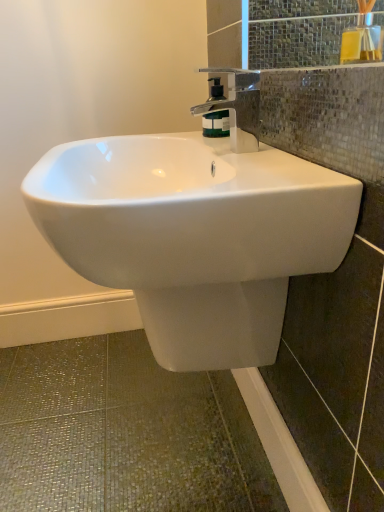
Question: From the image's perspective, is yellow glass bottle at upper right above or below white glossy sink at center?

Choices:
 (A) above
 (B) below

Answer: (A)

Question: Considering the positions of yellow glass bottle at upper right and white glossy sink at center in the image, is yellow glass bottle at upper right taller or shorter than white glossy sink at center?

Choices:
 (A) tall
 (B) short

Answer: (B)

Question: Which is nearer to the green matte soap dispenser at center?

Choices:
 (A) white glossy sink at center
 (B) yellow glass bottle at upper right
 (C) polished chrome faucet at upper center

Answer: (C)

Question: Which object is the farthest from the polished chrome faucet at upper center?

Choices:
 (A) white glossy sink at center
 (B) yellow glass bottle at upper right
 (C) green matte soap dispenser at center

Answer: (B)